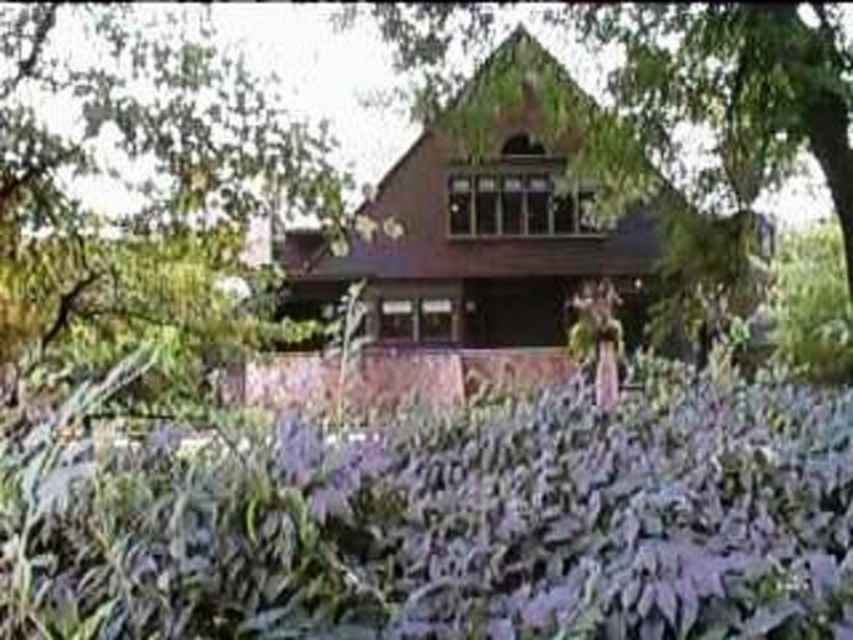
You are planning to install a small garden path between the green leafy tree at upper center and the green leafy tree at center. The path requires a minimum of 8 meters of space. Based on the scene, will there be enough space for the path?

The green leafy tree at upper center and green leafy tree at center are 9.16 meters apart, which is more than the required 8 meters, so there is enough space for the path.

You are standing in front of the rustic house and notice two green leafy trees. According to their positions, which tree is located to the left when comparing the green leafy tree at upper center and the green leafy tree at center?

The green leafy tree at upper center is positioned to the left of the green leafy tree at center.

You are standing in the garden in front of the house and want to know which tree is taller between the green leafy tree at upper center and the green leafy tree at center. Which one is taller?

The green leafy tree at center is taller than the green leafy tree at upper center.